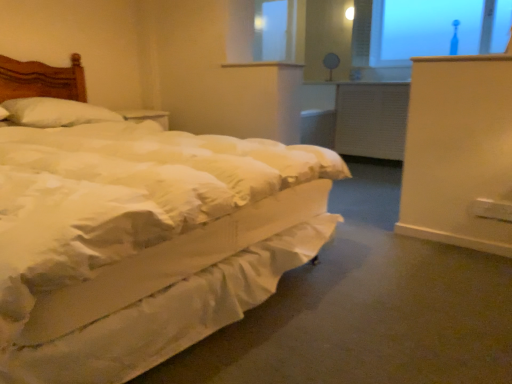
In order to face white textured radiator at center, should I rotate leftwards or rightwards?

To align with it, rotate right about 16.485°.

What are the coordinates of `white textured radiator at center` in the screenshot? It's located at (371, 119).

Where is `transparent glass window at upper right`? transparent glass window at upper right is located at coordinates (437, 29).

This screenshot has height=384, width=512. I want to click on white textured radiator at center, so click(x=371, y=119).

In terms of height, does transparent glass window at upper right look taller or shorter compared to white soft pillow at left?

transparent glass window at upper right is taller than white soft pillow at left.

Where is `window screen above the white soft pillow at left (from the image's perspective)`? The width and height of the screenshot is (512, 384). window screen above the white soft pillow at left (from the image's perspective) is located at coordinates (437, 29).

Do you think transparent glass window at upper right is within white soft pillow at left, or outside of it?

transparent glass window at upper right is spatially situated outside white soft pillow at left.

Considering the positions of objects matte white table lamp at upper center and white soft pillow at left in the image provided, who is more to the left, matte white table lamp at upper center or white soft pillow at left?

Positioned to the left is white soft pillow at left.

From a real-world perspective, which is physically above, matte white table lamp at upper center or white soft pillow at left?

From a 3D spatial view, matte white table lamp at upper center is above.

Is matte white table lamp at upper center closer to the viewer compared to white soft pillow at left?

No, matte white table lamp at upper center is behind white soft pillow at left.

Consider the image. Is white textured radiator at center taller or shorter than white soft pillow at left?

In the image, white textured radiator at center appears to be taller than white soft pillow at left.

Considering the relative sizes of white textured radiator at center and white soft pillow at left in the image provided, is white textured radiator at center bigger than white soft pillow at left?

Correct, white textured radiator at center is larger in size than white soft pillow at left.

Considering the points (376, 113) and (21, 111), which point is behind, point (376, 113) or point (21, 111)?

The point (376, 113) is farther from the camera.

Looking at their sizes, would you say transparent glass window at upper right is wider or thinner than white soft bed at left?

Clearly, transparent glass window at upper right has less width compared to white soft bed at left.

Considering the relative sizes of transparent glass window at upper right and white soft bed at left in the image provided, is transparent glass window at upper right bigger than white soft bed at left?

Actually, transparent glass window at upper right might be smaller than white soft bed at left.

From the image's perspective, is transparent glass window at upper right under white soft bed at left?

No.

How many degrees apart are the facing directions of transparent glass window at upper right and white soft bed at left?

There is a 90.9-degree angle between the facing directions of transparent glass window at upper right and white soft bed at left.

Would you say white soft bed at left is inside or outside matte white table lamp at upper center?

white soft bed at left lies outside matte white table lamp at upper center.

Which is in front, point (312, 154) or point (331, 69)?

The point (312, 154) is in front.

How distant is white soft bed at left from matte white table lamp at upper center?

white soft bed at left and matte white table lamp at upper center are 3.75 meters apart from each other.

Can you confirm if white soft bed at left is wider than matte white table lamp at upper center?

Correct, the width of white soft bed at left exceeds that of matte white table lamp at upper center.

From the image's perspective, which is below, white textured radiator at center or white soft bed at left?

white soft bed at left is shown below in the image.

From a real-world perspective, which is physically below, white textured radiator at center or white soft bed at left?

In real-world perspective, white textured radiator at center is lower.

Who is taller, white textured radiator at center or white soft bed at left?

white soft bed at left is taller.

From the picture: Could you tell me if white textured radiator at center is facing white soft bed at left?

Yes, white textured radiator at center is turned towards white soft bed at left.

From a real-world perspective, which object stands above the other?

From a 3D spatial view, matte white table lamp at upper center is above.

Consider the image. Is matte white table lamp at upper center further to camera compared to white textured radiator at center?

Yes, it is behind white textured radiator at center.

Can you tell me how much matte white table lamp at upper center and white textured radiator at center differ in facing direction?

The angle between the facing direction of matte white table lamp at upper center and the facing direction of white textured radiator at center is 35.8 degrees.

Which is more to the right, matte white table lamp at upper center or white textured radiator at center?

white textured radiator at center is more to the right.

At what (x,y) coordinates should I click in order to perform the action: click on pillow in front of the transparent glass window at upper right. Please return your answer as a coordinate pair (x, y). Looking at the image, I should click on [x=55, y=112].

This screenshot has width=512, height=384. What are the coordinates of `pillow located on the left of matte white table lamp at upper center` in the screenshot? It's located at (55, 112).

Based on their spatial positions, is white soft bed at left or white soft pillow at left closer to white textured radiator at center?

white soft pillow at left lies closer to white textured radiator at center than the other object.

Considering their positions, is white soft pillow at left positioned closer to white soft bed at left than matte white table lamp at upper center?

white soft pillow at left is closer to white soft bed at left.

Looking at the image, which one is located further to matte white table lamp at upper center, white soft pillow at left or white textured radiator at center?

white soft pillow at left is further to matte white table lamp at upper center.

Considering their positions, is white soft pillow at left positioned further to white textured radiator at center than white soft bed at left?

Based on the image, white soft bed at left appears to be further to white textured radiator at center.

Which object lies further to the anchor point white textured radiator at center, white soft pillow at left or transparent glass window at upper right?

white soft pillow at left.

Estimate the real-world distances between objects in this image. Which object is closer to white soft bed at left, white soft pillow at left or transparent glass window at upper right?

white soft pillow at left is positioned closer to the anchor white soft bed at left.

Looking at the image, which one is located further to white soft bed at left, transparent glass window at upper right or white soft pillow at left?

Based on the image, transparent glass window at upper right appears to be further to white soft bed at left.

Which object lies nearer to the anchor point transparent glass window at upper right, matte white table lamp at upper center or white soft pillow at left?

matte white table lamp at upper center.

Where is `window screen between white soft bed at left and matte white table lamp at upper center in the front-back direction`? The width and height of the screenshot is (512, 384). window screen between white soft bed at left and matte white table lamp at upper center in the front-back direction is located at coordinates (437, 29).

The height and width of the screenshot is (384, 512). In order to click on pillow between white soft bed at left and matte white table lamp at upper center along the z-axis in this screenshot , I will do click(x=55, y=112).

I want to click on bed between white soft pillow at left and transparent glass window at upper right in the horizontal direction, so tap(144, 241).

At what (x,y) coordinates should I click in order to perform the action: click on radiator between white soft pillow at left and transparent glass window at upper right. Please return your answer as a coordinate pair (x, y). Looking at the image, I should click on (371, 119).